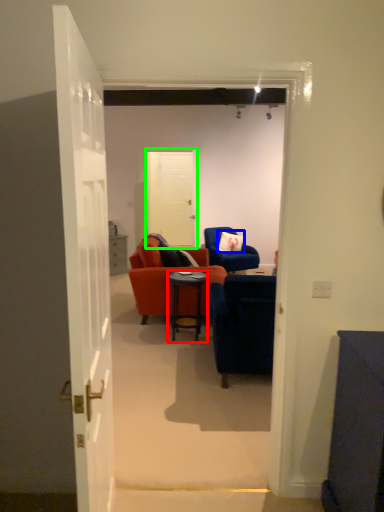
Question: Which object is the closest to the desk (highlighted by a red box)? Choose among these: pillow (highlighted by a blue box) or door (highlighted by a green box).

Choices:
 (A) pillow
 (B) door

Answer: (A)